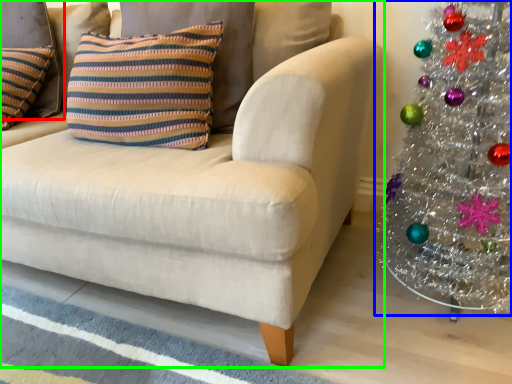
Question: Based on their relative distances, which object is nearer to pillow (highlighted by a red box)? Choose from christmas tree (highlighted by a blue box) and studio couch (highlighted by a green box).

Choices:
 (A) christmas tree
 (B) studio couch

Answer: (B)